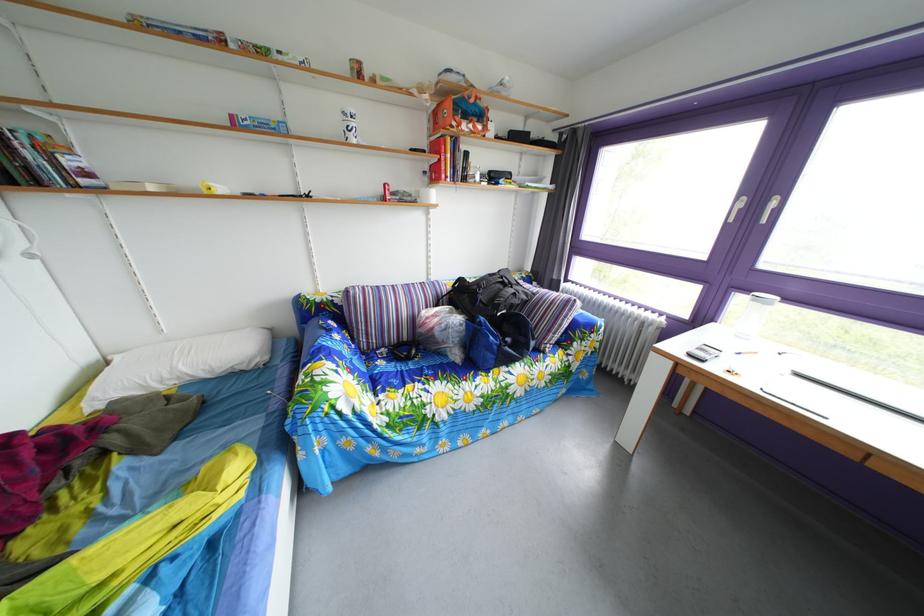
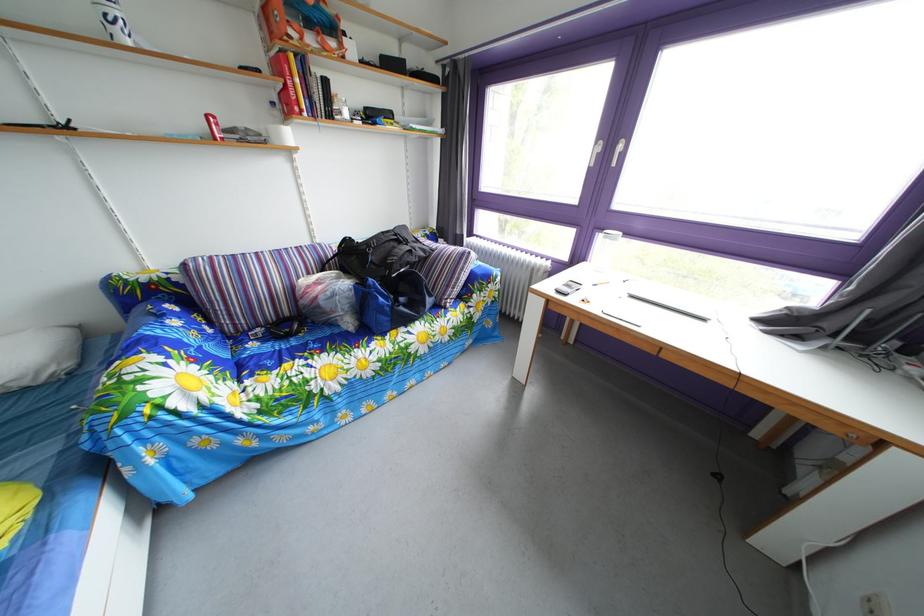
Question: In a continuous first-person perspective shot, in which direction is the camera moving?

Choices:
 (A) Left
 (B) Right
 (C) Forward
 (D) Backward

Answer: (B)